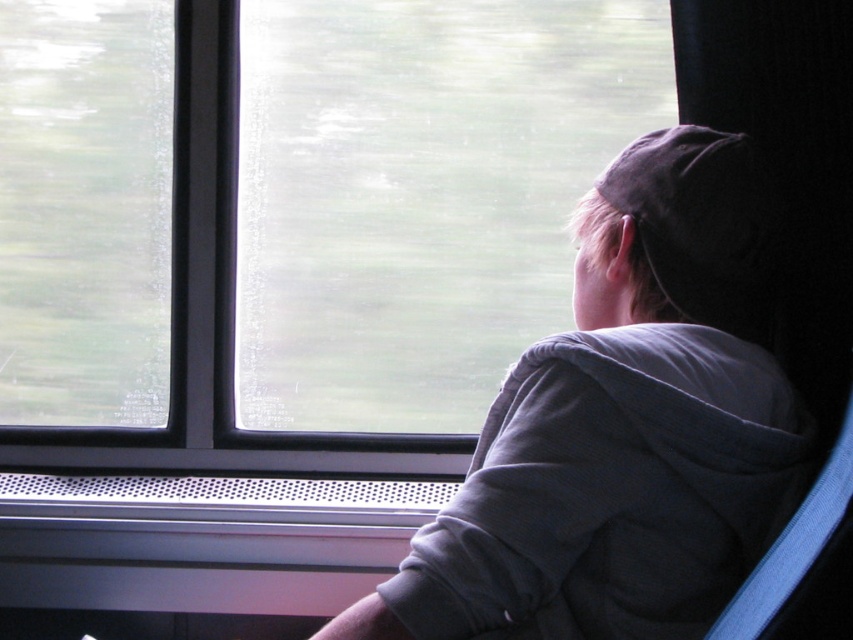
You are a passenger in a moving train or bus. You want to look outside through the transparent glass window at upper left. Is the window positioned in a place where you can easily reach it from your seat?

The transparent glass window at upper left is located at point (85, 211), which is relatively close to the passenger seat. Therefore, it should be easily reachable for the passenger to look outside.

You are a passenger on a moving train and want to know if you can fully see the jacket and window from your seat. The jacket is part of the same clothing as the hoodie mentioned in the scene. Are both the gray fleece jacket at upper right and the transparent glass window at upper left visible in their entirety from your current seat?

The gray fleece jacket at upper right is shorter than the transparent glass window at upper left, so the jacket is shorter and might be fully visible, but the window is taller and could be partially obscured depending on your seat angle. However, since the jacket is shorter, it is more likely both are visible entirely.

Looking at this image, you are a passenger on a moving train and want to place a small bag on the seat next to you. The seat is located at point 0.6 on the x and y axis. Can you place the bag there without overlapping the gray fleece jacket at upper right?

The gray fleece jacket at upper right is located at point [622,428]. The seat is at 0.6 on both axes, so the bag can be placed there without overlapping since the jacket is slightly to the right and above the seat position.